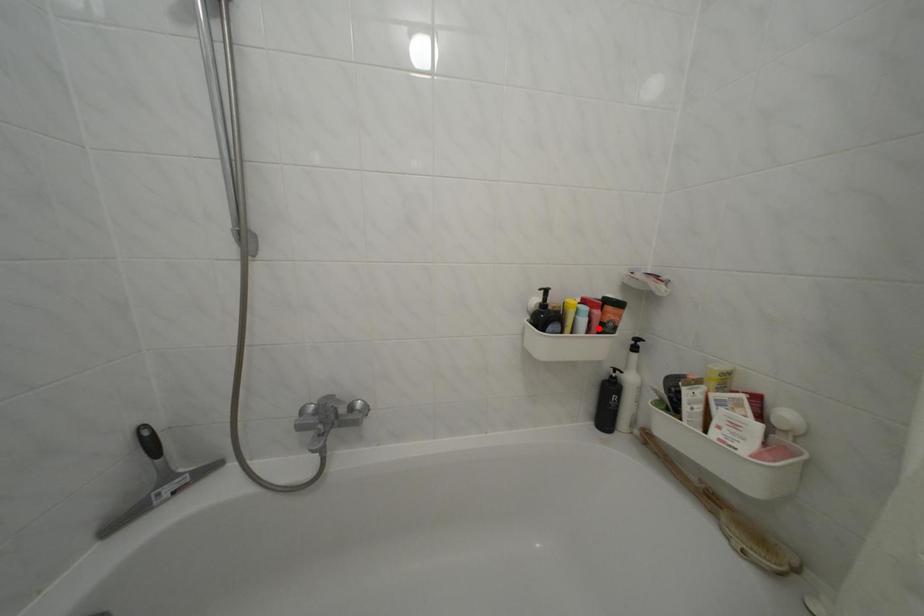
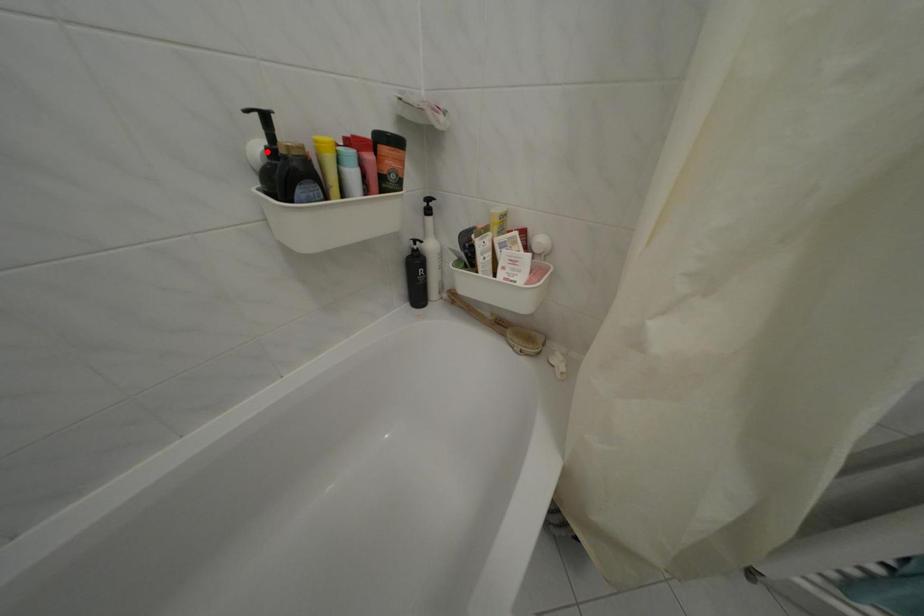
I am providing you with two images of the same scene from different viewpoints. A red point is marked on the first image and another point is marked on the second image. Does the point marked in image1 correspond to the same location as the one in image2?

No